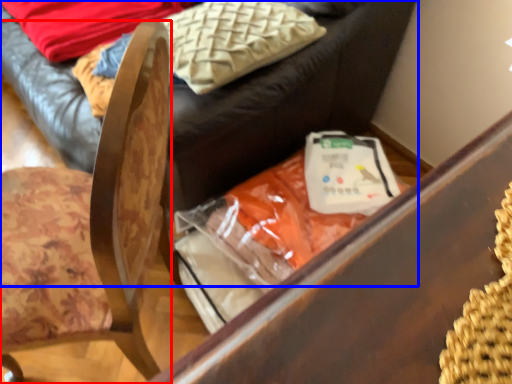
Question: Which point is further to the camera, chair (highlighted by a red box) or furniture (highlighted by a blue box)?

Choices:
 (A) chair
 (B) furniture

Answer: (B)